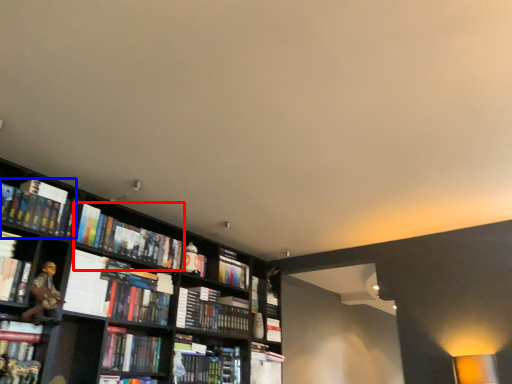
Question: Which object is further to the camera taking this photo, book (highlighted by a red box) or book (highlighted by a blue box)?

Choices:
 (A) book
 (B) book

Answer: (A)